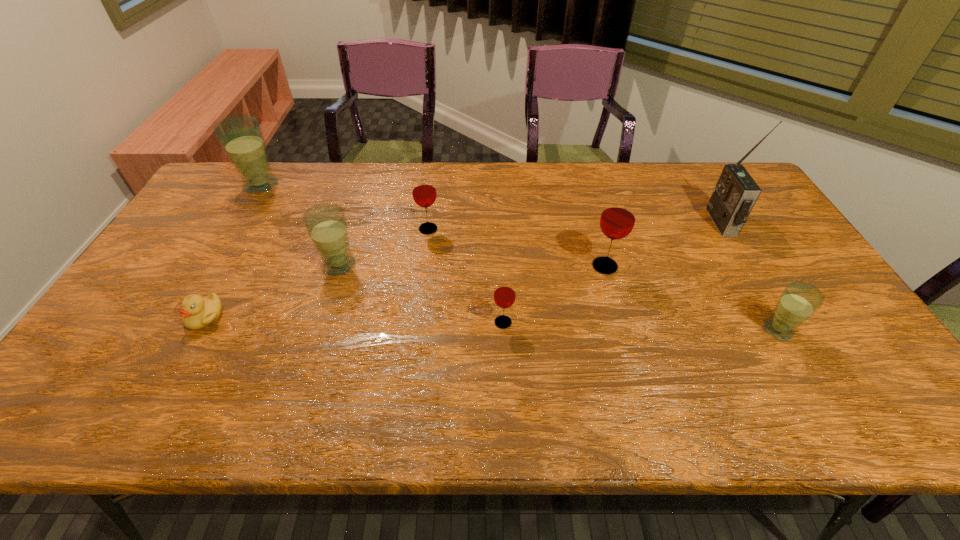
Where is `radio receiver`? radio receiver is located at coordinates (735, 194).

Where is `the fifth glass from left to right`? the fifth glass from left to right is located at coordinates (618, 217).

Find the location of a particular element. The width and height of the screenshot is (960, 540). the third object from right to left is located at coordinates (618, 217).

Locate an element on the screen. This screenshot has height=540, width=960. the farthest blue glass is located at coordinates (241, 137).

What are the coordinates of `the biggest blue glass` in the screenshot? It's located at (241, 137).

Identify the location of the farthest red glass. (424, 193).

Find the location of a particular element. This screenshot has width=960, height=540. the fifth nearest glass is located at coordinates (424, 193).

You are a GUI agent. You are given a task and a screenshot of the screen. Output one action in this format:
    pyautogui.click(x=<x>, y=<y>)
    Task: Click on the second smallest blue glass
    The height and width of the screenshot is (540, 960).
    Given the screenshot: What is the action you would take?
    pyautogui.click(x=326, y=224)

Identify the location of the second blue glass from left to right. (326, 224).

You are a GUI agent. You are given a task and a screenshot of the screen. Output one action in this format:
    pyautogui.click(x=<x>, y=<y>)
    Task: Click on the rightmost glass
    This screenshot has height=540, width=960.
    Given the screenshot: What is the action you would take?
    pyautogui.click(x=799, y=300)